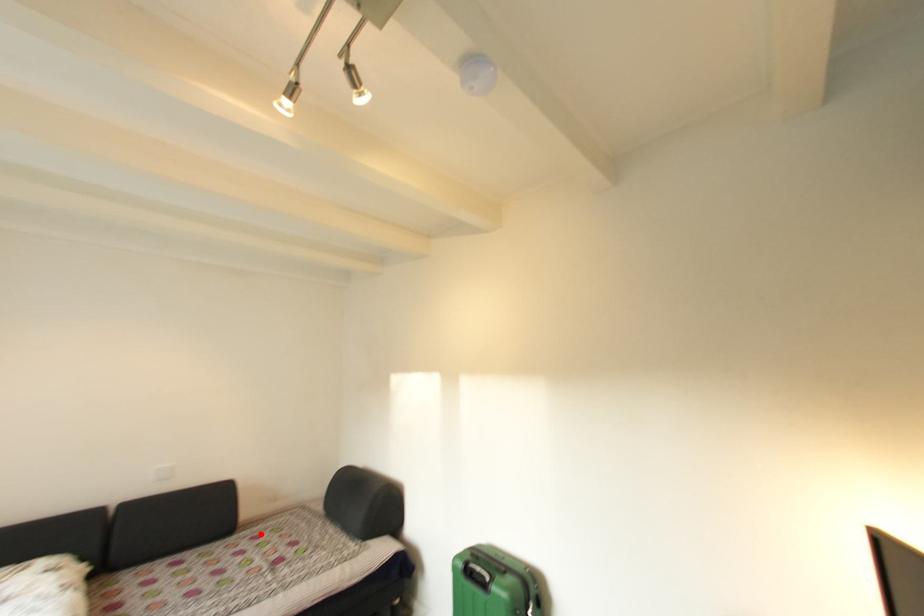
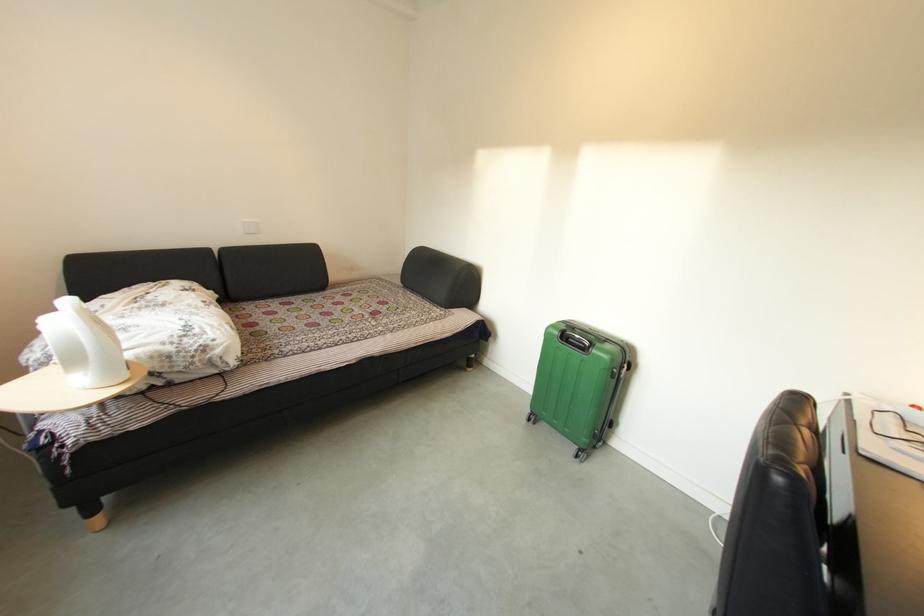
Find the pixel in the second image that matches the highlighted location in the first image.

(349, 293)